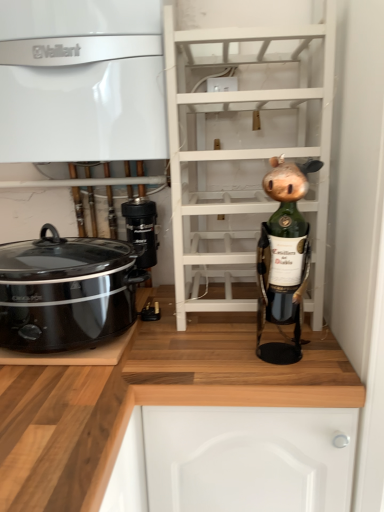
Image resolution: width=384 pixels, height=512 pixels. I want to click on vacant area that lies between black plastic slow cooker at left and green matte wine bottle at right, so click(x=204, y=351).